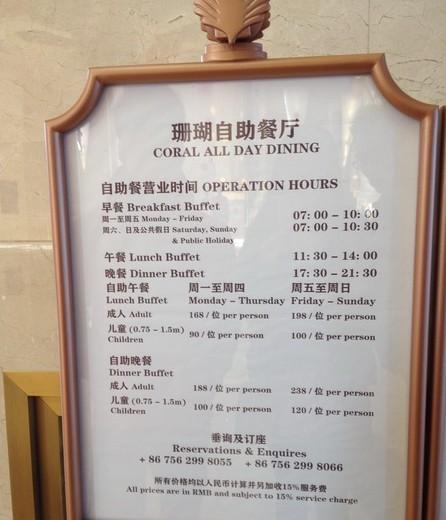
Identify the location of pillar on top of menu frame. (231, 22).